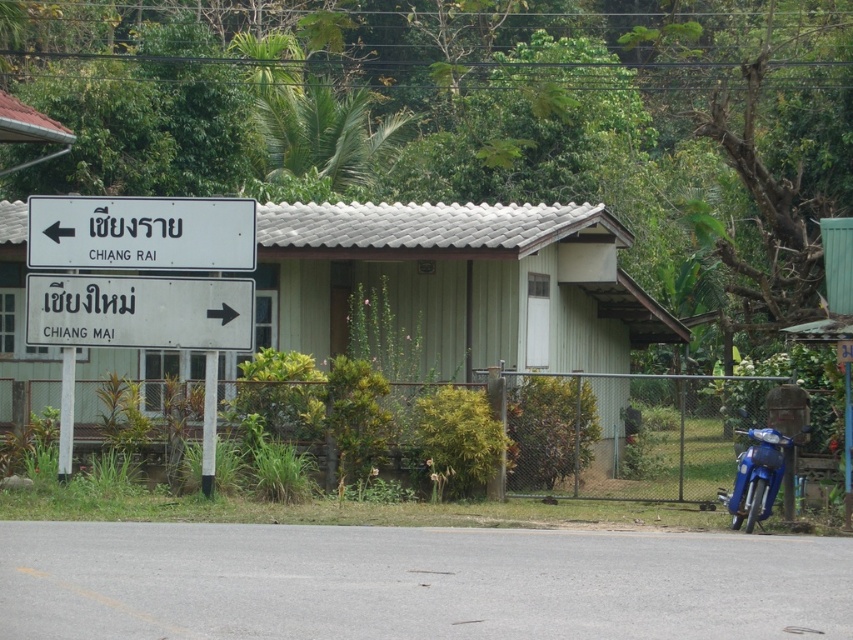
Question: Does blue metallic motorcycle at lower right appear on the left side of white plastic pole at lower center?

Choices:
 (A) no
 (B) yes

Answer: (A)

Question: Which of the following is the farthest from the observer?

Choices:
 (A) green wood hut at center
 (B) white matte sign at center

Answer: (A)

Question: Is white plastic sign at left to the left of blue metallic motorcycle at lower right from the viewer's perspective?

Choices:
 (A) no
 (B) yes

Answer: (B)

Question: Which of these objects is positioned closest to the white plastic pole at lower center?

Choices:
 (A) white matte sign at center
 (B) green wood hut at center
 (C) blue metallic motorcycle at lower right
 (D) white plastic sign at left

Answer: (A)

Question: Is the position of white plastic sign at left less distant than that of white matte sign at center?

Choices:
 (A) yes
 (B) no

Answer: (A)

Question: Which of the following is the farthest from the observer?

Choices:
 (A) white plastic pole at left
 (B) blue metallic motorcycle at lower right
 (C) white plastic pole at lower center
 (D) white plastic sign at left

Answer: (A)